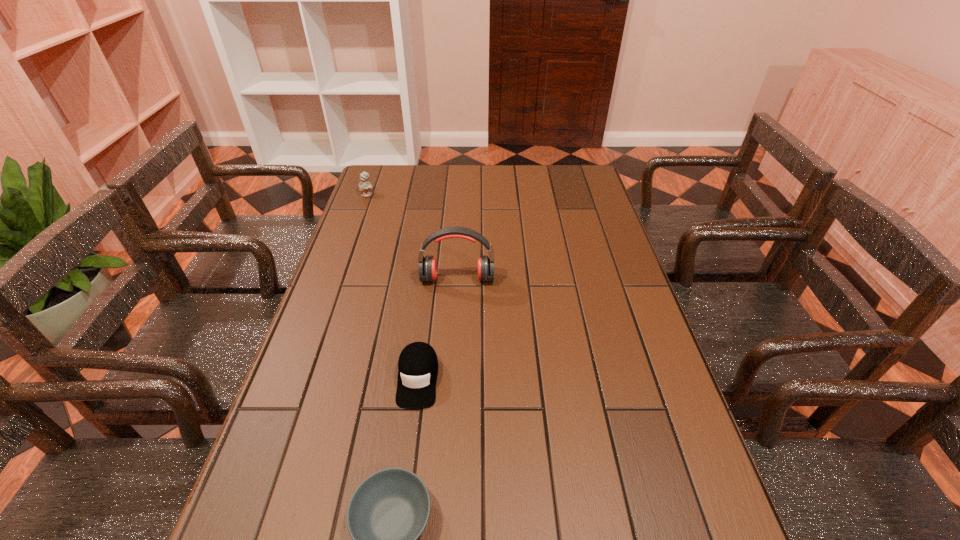
Locate an element on the screen. vacant area that lies between the second shortest object and the farthest object is located at coordinates (393, 286).

The image size is (960, 540). Identify the location of free spot between the second shortest object and the tallest object. (438, 328).

You are a GUI agent. You are given a task and a screenshot of the screen. Output one action in this format:
    pyautogui.click(x=<x>, y=<y>)
    Task: Click on the object that stands as the third closest to the leftmost object
    
    Given the screenshot: What is the action you would take?
    pyautogui.click(x=387, y=513)

Locate which object ranks in proximity to the third shortest object. Please provide its 2D coordinates. Your answer should be formatted as a tuple, i.e. [(x, y)], where the tuple contains the x and y coordinates of a point satisfying the conditions above.

[(427, 265)]